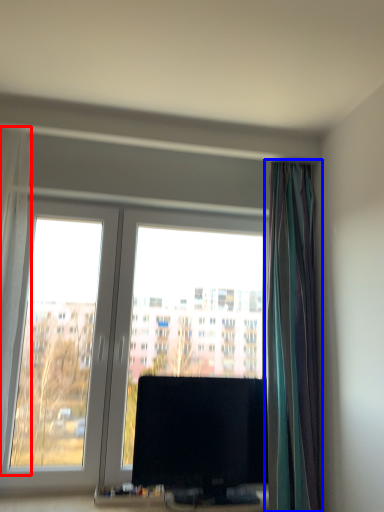
Question: Which of the following is the closest to the observer, curtain (highlighted by a red box) or curtain (highlighted by a blue box)?

Choices:
 (A) curtain
 (B) curtain

Answer: (A)